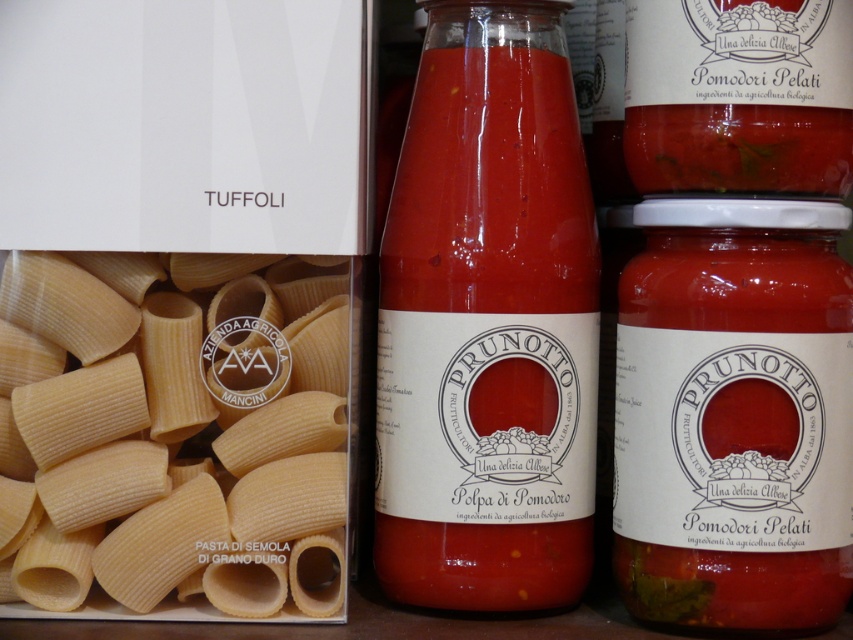
Can you confirm if yellow semolina pasta at center is wider than translucent glass bottle at center?

Yes.

Can you confirm if yellow semolina pasta at center is positioned to the right of translucent glass bottle at center?

In fact, yellow semolina pasta at center is to the left of translucent glass bottle at center.

Is point (28, 512) positioned behind point (468, 531)?

No, it is in front of (468, 531).

You are a GUI agent. You are given a task and a screenshot of the screen. Output one action in this format:
    pyautogui.click(x=<x>, y=<y>)
    Task: Click on the yellow semolina pasta at center
    This screenshot has width=853, height=640.
    Given the screenshot: What is the action you would take?
    pyautogui.click(x=173, y=435)